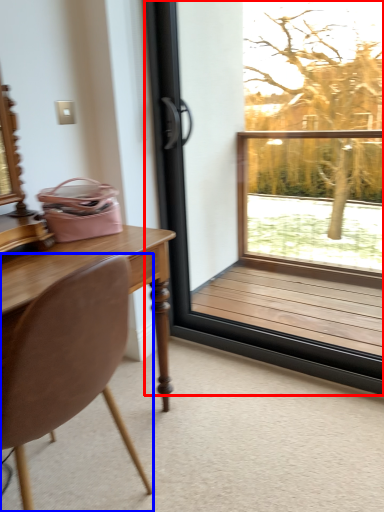
Question: Which of the following is the farthest to the observer, window (highlighted by a red box) or chair (highlighted by a blue box)?

Choices:
 (A) window
 (B) chair

Answer: (A)